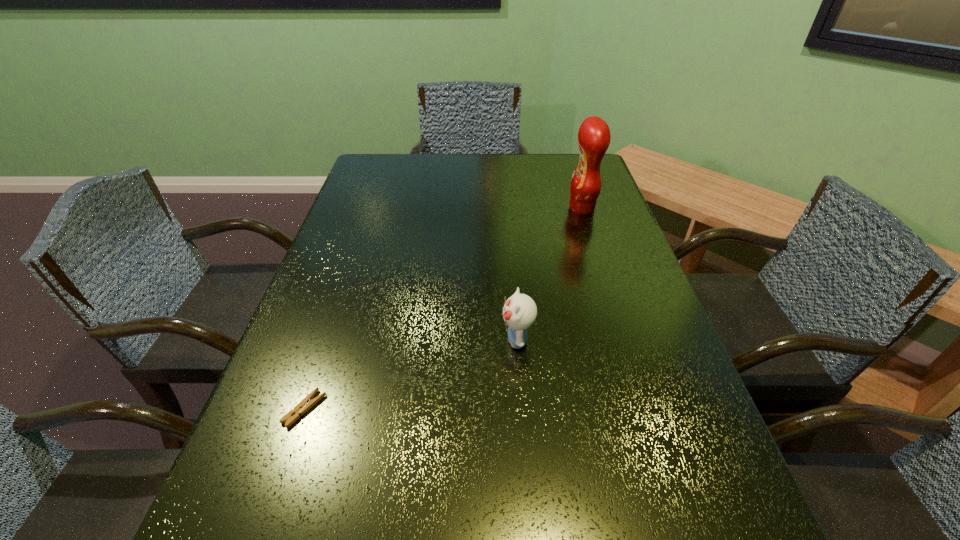
Locate an element on the screen. Image resolution: width=960 pixels, height=540 pixels. object that is the second nearest to the second shortest object is located at coordinates (594, 137).